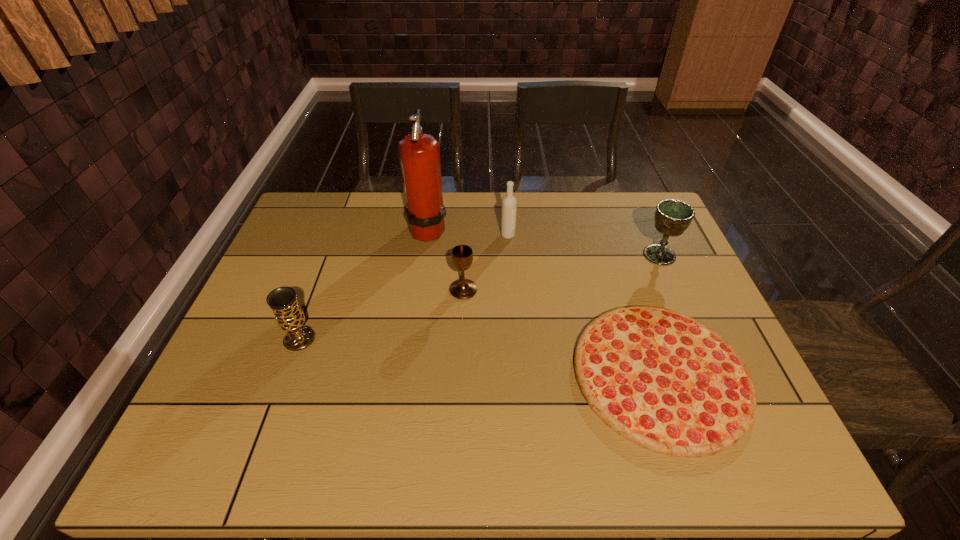
Identify the location of vacant space that satisfies the following two spatial constraints: 1. at the nozzle of the pizza; 2. on the right side of the fire extinguisher. (408, 374).

Locate an element on the screen. free space that satisfies the following two spatial constraints: 1. on the back side of the second chalice from left to right; 2. at the nozzle of the fifth object from right to left is located at coordinates (466, 228).

At what (x,y) coordinates should I click in order to perform the action: click on free space that satisfies the following two spatial constraints: 1. at the nozzle of the rightmost chalice; 2. on the right side of the tallest object. Please return your answer as a coordinate pair (x, y). This screenshot has width=960, height=540. Looking at the image, I should click on (424, 255).

Where is `free space that satisfies the following two spatial constraints: 1. on the back side of the second farthest chalice; 2. at the nozzle of the second object from left to right`? The image size is (960, 540). free space that satisfies the following two spatial constraints: 1. on the back side of the second farthest chalice; 2. at the nozzle of the second object from left to right is located at coordinates (466, 228).

Locate an element on the screen. free space that satisfies the following two spatial constraints: 1. at the nozzle of the fire extinguisher; 2. on the left side of the rightmost chalice is located at coordinates (424, 255).